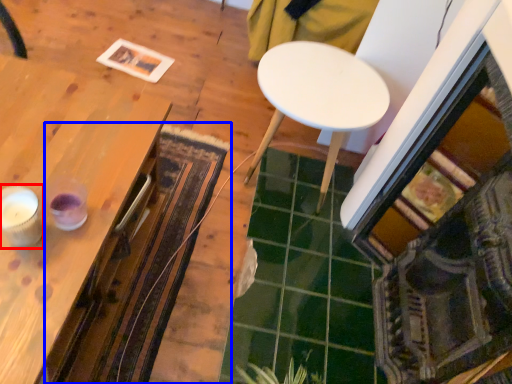
Question: Which object appears closest to the camera in this image, candle holder (highlighted by a red box) or mat (highlighted by a blue box)?

Choices:
 (A) candle holder
 (B) mat

Answer: (A)